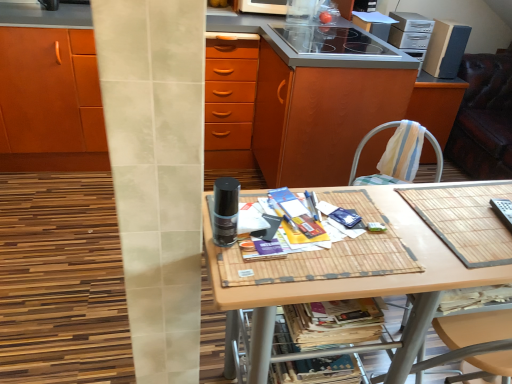
Question: Does matte paper magazine at center, arranged as the 1th magazine when viewed from the top, have a smaller size compared to leather-like swivel chair at right?

Choices:
 (A) no
 (B) yes

Answer: (B)

Question: Does matte paper magazine at center, the second magazine in the bottom-to-top sequence, lie behind leather-like swivel chair at right?

Choices:
 (A) no
 (B) yes

Answer: (A)

Question: Is matte paper magazine at center, the second magazine in the bottom-to-top sequence, closer to the viewer compared to leather-like swivel chair at right?

Choices:
 (A) no
 (B) yes

Answer: (B)

Question: Is matte paper magazine at center, the second magazine in the bottom-to-top sequence, thinner than leather-like swivel chair at right?

Choices:
 (A) yes
 (B) no

Answer: (A)

Question: Is matte paper magazine at center, the second magazine in the bottom-to-top sequence, aimed at leather-like swivel chair at right?

Choices:
 (A) no
 (B) yes

Answer: (A)

Question: Is matte paper magazine at center, arranged as the 1th magazine when viewed from the top, bigger than leather-like swivel chair at right?

Choices:
 (A) no
 (B) yes

Answer: (A)

Question: Is black glass stove at upper center, which is the 2th appliance in bottom-to-top order, closer to the viewer compared to leather-like swivel chair at right?

Choices:
 (A) no
 (B) yes

Answer: (B)

Question: From a real-world perspective, does black glass stove at upper center, which is the 2th appliance in bottom-to-top order, stand above leather-like swivel chair at right?

Choices:
 (A) no
 (B) yes

Answer: (B)

Question: Are black glass stove at upper center, the second appliance viewed from the back, and leather-like swivel chair at right beside each other?

Choices:
 (A) yes
 (B) no

Answer: (B)

Question: Is black glass stove at upper center, which appears as the 2th appliance when viewed from the top, wider than leather-like swivel chair at right?

Choices:
 (A) yes
 (B) no

Answer: (B)

Question: Is black glass stove at upper center, marked as the second appliance in a front-to-back arrangement, far from leather-like swivel chair at right?

Choices:
 (A) yes
 (B) no

Answer: (B)

Question: Is black glass stove at upper center, the second appliance viewed from the back, to the right of leather-like swivel chair at right from the viewer's perspective?

Choices:
 (A) yes
 (B) no

Answer: (B)

Question: Can we say bamboo mat at center lies outside printed paper magazine at lower center, positioned as the 2th magazine in top-to-bottom order?

Choices:
 (A) yes
 (B) no

Answer: (A)